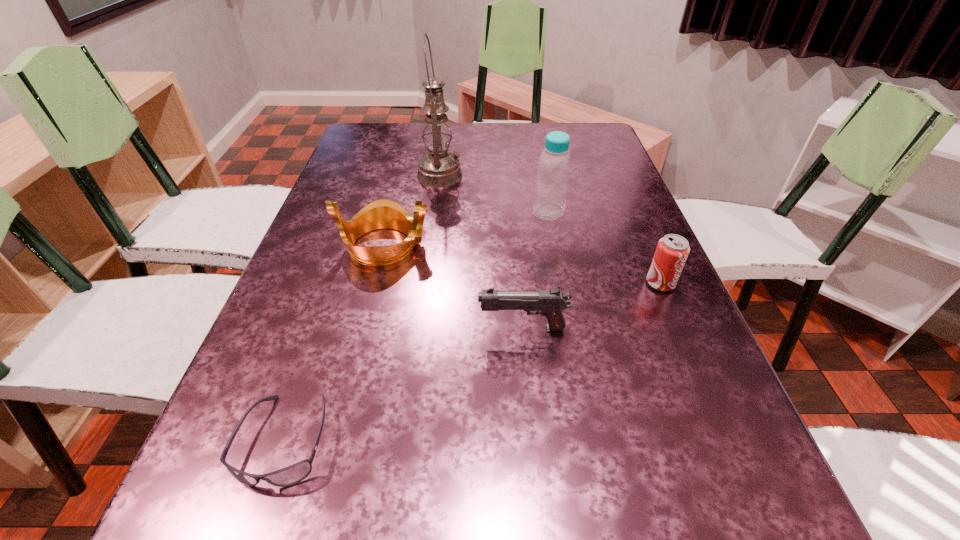
Identify the location of vacant area at the far edge. (537, 131).

What are the coordinates of `vacant space at the left edge` in the screenshot? It's located at (305, 318).

This screenshot has height=540, width=960. What are the coordinates of `free spot at the right edge of the desktop` in the screenshot? It's located at (603, 177).

In order to click on free space at the far right corner of the desktop in this screenshot , I will do `click(605, 133)`.

What are the coordinates of `empty space between the tiara and the rightmost object` in the screenshot? It's located at (522, 265).

Locate an element on the screen. vacant space in between the tiara and the nearest object is located at coordinates (334, 342).

Locate an element on the screen. free spot between the sunglasses and the soda can is located at coordinates (472, 361).

Identify the location of empty space that is in between the tiara and the soda can. (522, 265).

The image size is (960, 540). I want to click on vacant area that lies between the tiara and the second nearest object, so click(x=453, y=287).

This screenshot has width=960, height=540. Identify the location of free spot between the rightmost object and the tiara. (522, 265).